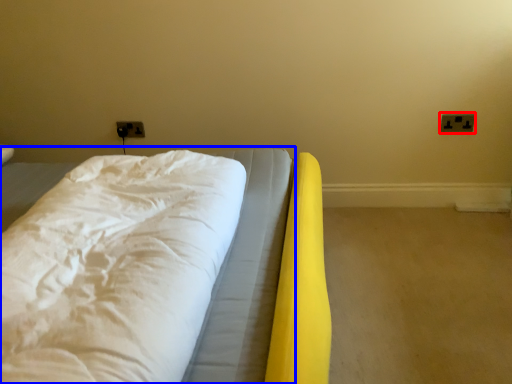
Question: Which point is closer to the camera, electric outlet (highlighted by a red box) or bed (highlighted by a blue box)?

Choices:
 (A) electric outlet
 (B) bed

Answer: (B)